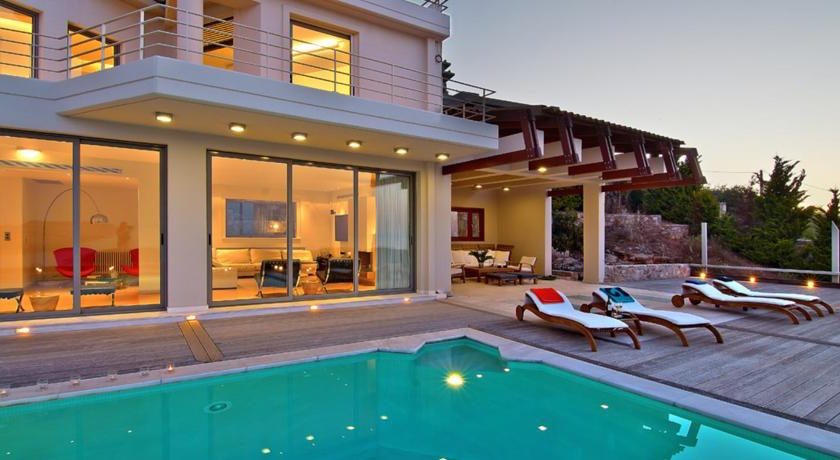
I want to click on blue towel, so click(x=617, y=289).